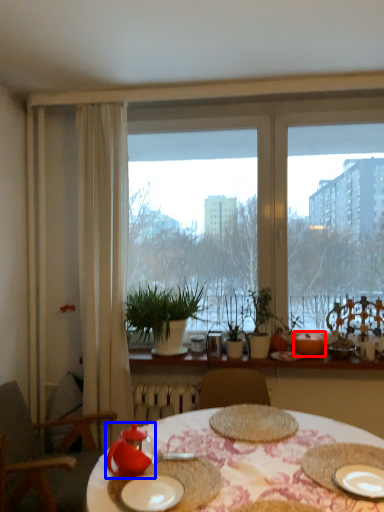
Question: Which of the following is the farthest to the observer, fruit (highlighted by a red box) or tableware (highlighted by a blue box)?

Choices:
 (A) fruit
 (B) tableware

Answer: (A)